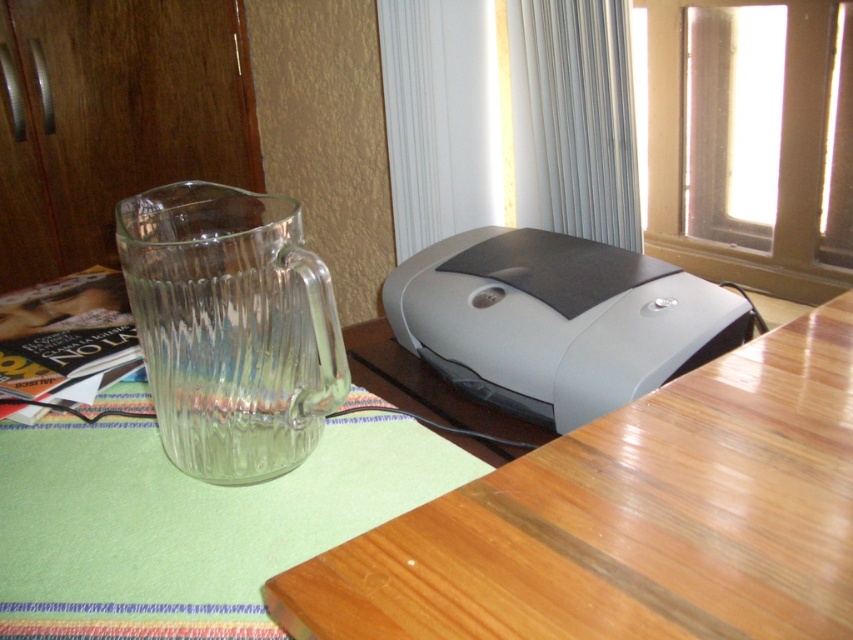
You are setting up a small dining area and need to place a 20 cm wide decorative plate between the wooden table at upper right and the clear glass pitcher at lower left. Is there enough space between them to fit the plate?

The wooden table at upper right and clear glass pitcher at lower left are 18.71 centimeters apart. Since the decorative plate is 20 cm wide, it won not fit between them as the distance is smaller than the plate.

You are setting up a dinner table and need to place both the clear glass pitcher at lower left and the gray matte printer at center on the table. Considering their sizes, which object should you place first to ensure there is enough space for both?

The clear glass pitcher at lower left is thinner than the gray matte printer at center, so you should place the gray matte printer at center first to ensure there is enough space for the thinner pitcher afterward.

You are a delivery person who needs to place a small package on the closest surface to you. You see the wooden table at upper right and the gray matte printer at center. Which surface should you choose?

The wooden table at upper right is closer to the viewer than the gray matte printer at center, so you should place the package on the wooden table at upper right.